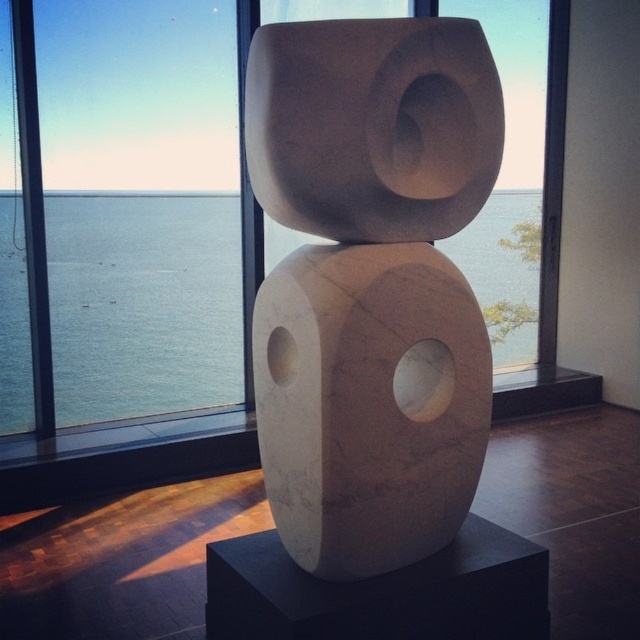
Question: Is the position of blue water at center less distant than that of transparent glass window at center?

Choices:
 (A) no
 (B) yes

Answer: (A)

Question: Which object appears closest to the camera in this image?

Choices:
 (A) white marble sculpture at center
 (B) transparent glass window at center

Answer: (A)

Question: Can you confirm if white marble sculpture at center is smaller than blue water at center?

Choices:
 (A) no
 (B) yes

Answer: (B)

Question: Which object is the farthest from the white marble sculpture at center?

Choices:
 (A) transparent glass window at center
 (B) blue water at center

Answer: (B)

Question: Can you confirm if white marble sculpture at center is smaller than transparent glass window at center?

Choices:
 (A) yes
 (B) no

Answer: (B)

Question: Which of the following is the closest to the observer?

Choices:
 (A) white marble sculpture at center
 (B) transparent glass window at center
 (C) blue water at center

Answer: (A)